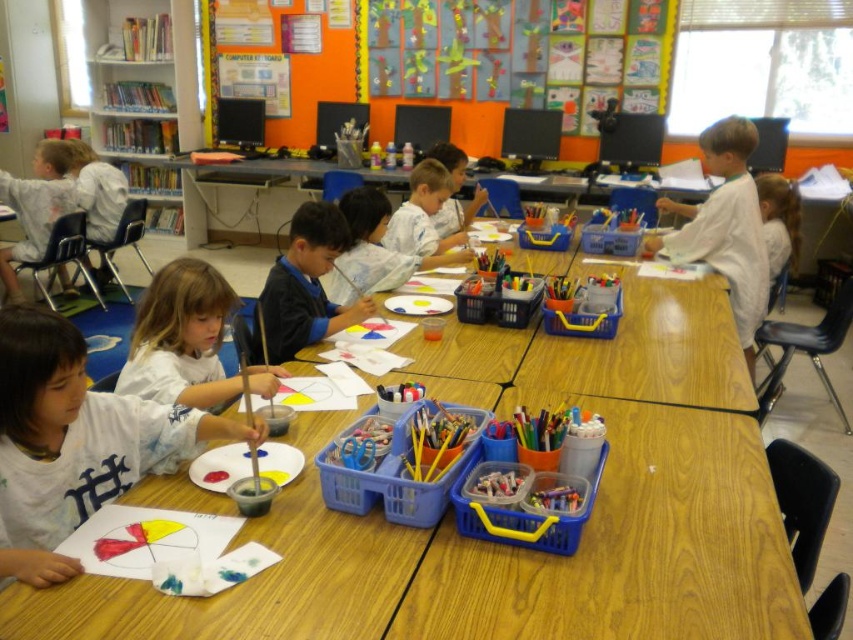
Between colorful paper art at upper center and dark blue sweater at center, which one appears on the left side from the viewer's perspective?

From the viewer's perspective, dark blue sweater at center appears more on the left side.

Is colorful paper art at upper center shorter than dark blue sweater at center?

No.

Find the location of `colorful paper art at upper center`. colorful paper art at upper center is located at coordinates (524, 52).

Can you confirm if matte white shirt at lower left is positioned to the right of smooth white shirt at center?

In fact, matte white shirt at lower left is to the left of smooth white shirt at center.

Is matte white shirt at lower left above smooth white shirt at center?

Incorrect, matte white shirt at lower left is not positioned above smooth white shirt at center.

Which is behind, point (25, 397) or point (440, 152)?

The point (440, 152) is more distant.

The image size is (853, 640). Find the location of `matte white shirt at lower left`. matte white shirt at lower left is located at coordinates (73, 442).

Does matte white shirt at lower left have a larger size compared to colorful paper art at upper center?

No.

Can you confirm if matte white shirt at lower left is wider than colorful paper art at upper center?

No.

The height and width of the screenshot is (640, 853). What do you see at coordinates (73, 442) in the screenshot? I see `matte white shirt at lower left` at bounding box center [73, 442].

Locate an element on the screen. matte white shirt at lower left is located at coordinates [73, 442].